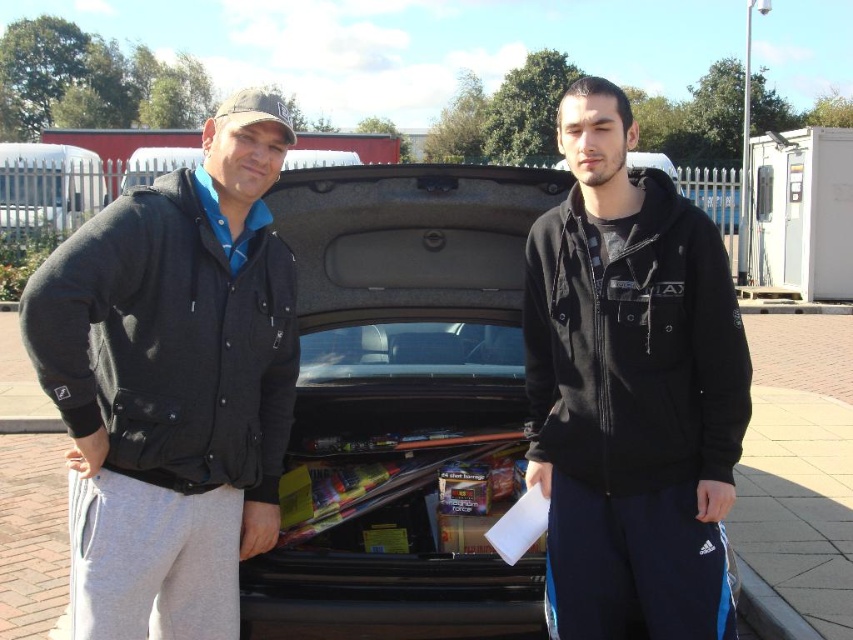
You are trying to locate the dark gray fleece jacket at left in the image. According to the coordinates provided, where exactly is it positioned?

The dark gray fleece jacket at left is located at point 0.600 on the x axis and 0.204 on the y axis.

From the picture: You are taking a photo of the two people and the car trunk. If you want to focus on both the point at point [67,321] and the point at point [672,378] in the image, will you need to adjust your camera focus to capture both clearly?

Since point [67,321] is closer to the camera than point [672,378], you will need to adjust the camera focus to ensure both points are in focus. However, standard camera focus might struggle with objects at different distances unless using a large depth of field.